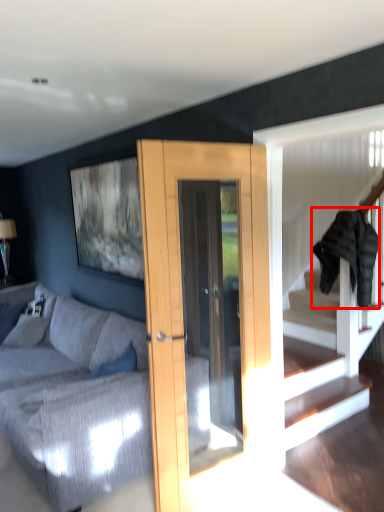
Question: In this image, where is clothe (annotated by the red box) located relative to studio couch?

Choices:
 (A) right
 (B) left

Answer: (A)